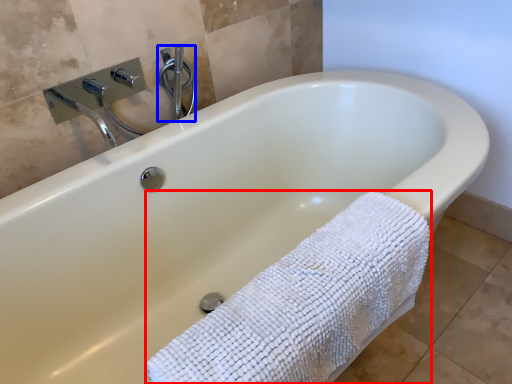
Question: Which object appears farthest to the camera in this image, bath towel (highlighted by a red box) or shower (highlighted by a blue box)?

Choices:
 (A) bath towel
 (B) shower

Answer: (B)